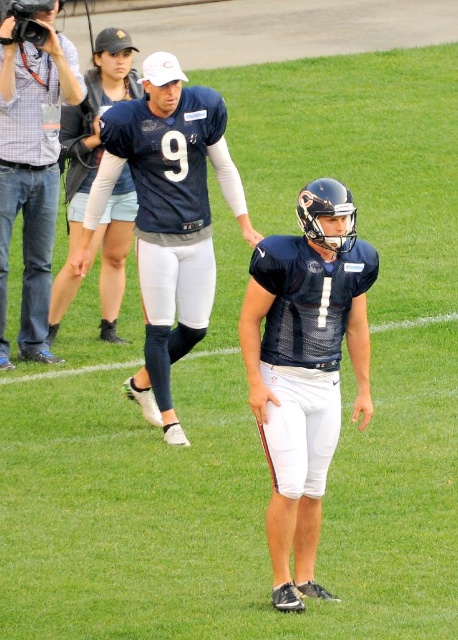
Is matte blue uniform at center bigger than white matte sideline at lower center?

Indeed, matte blue uniform at center has a larger size compared to white matte sideline at lower center.

Which is more to the right, matte blue uniform at center or white matte sideline at lower center?

Positioned to the right is matte blue uniform at center.

Which is behind, point (206, 230) or point (14, 376)?

Point (14, 376)

Identify the location of matte blue uniform at center. Image resolution: width=458 pixels, height=640 pixels. (168, 218).

Find the location of a particular element. This screenshot has height=640, width=458. matte blue uniform at center is located at coordinates (168, 218).

Which is below, matte blue uniform at center or matte black camera at left?

matte blue uniform at center

Image resolution: width=458 pixels, height=640 pixels. What do you see at coordinates (168, 218) in the screenshot?
I see `matte blue uniform at center` at bounding box center [168, 218].

You are a GUI agent. You are given a task and a screenshot of the screen. Output one action in this format:
    pyautogui.click(x=<x>, y=<y>)
    Task: Click on the matte blue uniform at center
    The height and width of the screenshot is (640, 458).
    Given the screenshot: What is the action you would take?
    pyautogui.click(x=168, y=218)

Can you confirm if navy blue uniform at center is shorter than white matte sideline at lower center?

Incorrect, navy blue uniform at center's height does not fall short of white matte sideline at lower center's.

Is navy blue uniform at center thinner than white matte sideline at lower center?

Correct, navy blue uniform at center's width is less than white matte sideline at lower center's.

Which is behind, point (261, 428) or point (87, 369)?

The point (87, 369) is behind.

This screenshot has width=458, height=640. Find the location of `navy blue uniform at center`. navy blue uniform at center is located at coordinates (305, 368).